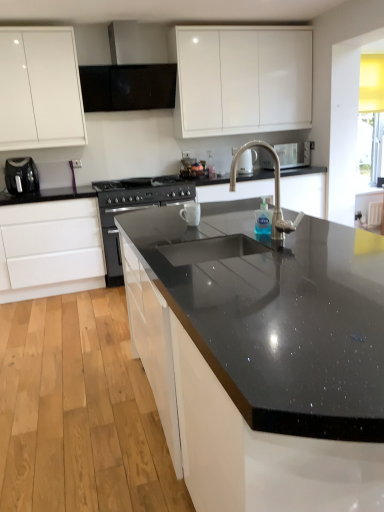
Describe the element at coordinates (275, 191) in the screenshot. This screenshot has width=384, height=512. I see `polished stainless steel faucet at center` at that location.

Image resolution: width=384 pixels, height=512 pixels. What are the coordinates of `black matte exhaust hood at upper center` in the screenshot? It's located at (131, 71).

What is the approximate height of black matte exhaust hood at upper center?

black matte exhaust hood at upper center is 29.88 inches tall.

The height and width of the screenshot is (512, 384). Describe the element at coordinates (274, 193) in the screenshot. I see `black granite sink at center` at that location.

The width and height of the screenshot is (384, 512). What are the coordinates of `satin nickel faucet at upper center, which is counted as the 2th appliance, starting from the left` in the screenshot? It's located at click(x=293, y=154).

Considering the positions of point (20, 276) and point (282, 236), is point (20, 276) closer or farther from the camera than point (282, 236)?

Point (20, 276).

From the image's perspective, is white matte drawer at lower left, marked as the 1th cabinetry in a bottom-to-top arrangement, above or below polished stainless steel faucet at center?

white matte drawer at lower left, marked as the 1th cabinetry in a bottom-to-top arrangement, is below polished stainless steel faucet at center.

Is white matte drawer at lower left, marked as the 1th cabinetry in a bottom-to-top arrangement, to the left or to the right of polished stainless steel faucet at center in the image?

white matte drawer at lower left, marked as the 1th cabinetry in a bottom-to-top arrangement, is to the left of polished stainless steel faucet at center.

Considering the sizes of white matte drawer at lower left, the 2th cabinetry when ordered from top to bottom, and polished stainless steel faucet at center in the image, is white matte drawer at lower left, the 2th cabinetry when ordered from top to bottom, bigger or smaller than polished stainless steel faucet at center?

Clearly, white matte drawer at lower left, the 2th cabinetry when ordered from top to bottom, is larger in size than polished stainless steel faucet at center.

From the image's perspective, which is below, black matte exhaust hood at upper center or polished stainless steel faucet at center?

polished stainless steel faucet at center.

Considering the relative sizes of black matte exhaust hood at upper center and polished stainless steel faucet at center in the image provided, is black matte exhaust hood at upper center thinner than polished stainless steel faucet at center?

Incorrect, the width of black matte exhaust hood at upper center is not less than that of polished stainless steel faucet at center.

Is black matte exhaust hood at upper center bigger than polished stainless steel faucet at center?

Yes.

In terms of height, does satin nickel faucet at upper center, which ranks as the 1th appliance in top-to-bottom order, look taller or shorter compared to white matte drawer at lower left, the 2th cabinetry when ordered from top to bottom?

satin nickel faucet at upper center, which ranks as the 1th appliance in top-to-bottom order, is shorter than white matte drawer at lower left, the 2th cabinetry when ordered from top to bottom.

Is satin nickel faucet at upper center, which is counted as the 2th appliance, starting from the left, bigger than white matte drawer at lower left, the 2th cabinetry when ordered from top to bottom?

No, satin nickel faucet at upper center, which is counted as the 2th appliance, starting from the left, is not bigger than white matte drawer at lower left, the 2th cabinetry when ordered from top to bottom.

Is satin nickel faucet at upper center, which is counted as the 2th appliance, starting from the left, inside or outside of white matte drawer at lower left, marked as the 1th cabinetry in a bottom-to-top arrangement?

satin nickel faucet at upper center, which is counted as the 2th appliance, starting from the left, lies outside white matte drawer at lower left, marked as the 1th cabinetry in a bottom-to-top arrangement.

Consider the image. From a real-world perspective, which is physically below, satin nickel faucet at upper center, marked as the 1th appliance in a back-to-front arrangement, or white matte drawer at lower left, marked as the 1th cabinetry in a bottom-to-top arrangement?

white matte drawer at lower left, marked as the 1th cabinetry in a bottom-to-top arrangement.

Is white glossy cabinet at upper left, which ranks as the 2th cabinetry in bottom-to-top order, a part of black granite sink at center?

Definitely not — white glossy cabinet at upper left, which ranks as the 2th cabinetry in bottom-to-top order, is not inside black granite sink at center.

Considering the points (192, 219) and (44, 33), which point is in front, point (192, 219) or point (44, 33)?

The point (192, 219) is more forward.

Is black granite sink at center touching white glossy cabinet at upper left, marked as the first cabinetry in a top-to-bottom arrangement?

No, black granite sink at center is not beside white glossy cabinet at upper left, marked as the first cabinetry in a top-to-bottom arrangement.

Is black granite sink at center turned away from white glossy cabinet at upper left, marked as the first cabinetry in a top-to-bottom arrangement?

No, white glossy cabinet at upper left, marked as the first cabinetry in a top-to-bottom arrangement, is not at the back of black granite sink at center.

Does white matte drawer at lower left, marked as the 1th cabinetry in a bottom-to-top arrangement, have a larger size compared to black matte exhaust hood at upper center?

Yes.

From the picture: Which of these two, white matte drawer at lower left, the 2th cabinetry when ordered from top to bottom, or black matte exhaust hood at upper center, stands taller?

white matte drawer at lower left, the 2th cabinetry when ordered from top to bottom.

From the image's perspective, which one is positioned lower, white matte drawer at lower left, the 2th cabinetry when ordered from top to bottom, or black matte exhaust hood at upper center?

white matte drawer at lower left, the 2th cabinetry when ordered from top to bottom, is shown below in the image.

Is white matte drawer at lower left, the 2th cabinetry when ordered from top to bottom, positioned beyond the bounds of black matte exhaust hood at upper center?

Absolutely, white matte drawer at lower left, the 2th cabinetry when ordered from top to bottom, is external to black matte exhaust hood at upper center.

Is black granite sink at center far away from satin nickel faucet at upper center, which is the first appliance in right-to-left order?

No, black granite sink at center is in close proximity to satin nickel faucet at upper center, which is the first appliance in right-to-left order.

Does black granite sink at center have a greater height compared to satin nickel faucet at upper center, which ranks as the 1th appliance in top-to-bottom order?

Indeed, black granite sink at center has a greater height compared to satin nickel faucet at upper center, which ranks as the 1th appliance in top-to-bottom order.

From the image's perspective, relative to satin nickel faucet at upper center, which is the second appliance in bottom-to-top order, is black granite sink at center above or below?

From the image's perspective, black granite sink at center appears below satin nickel faucet at upper center, which is the second appliance in bottom-to-top order.

Does black granite sink at center contain white matte drawer at lower left, marked as the 1th cabinetry in a bottom-to-top arrangement?

No, white matte drawer at lower left, marked as the 1th cabinetry in a bottom-to-top arrangement, is not a part of black granite sink at center.

Is black granite sink at center closer to camera compared to white matte drawer at lower left, marked as the 1th cabinetry in a bottom-to-top arrangement?

No, black granite sink at center is further to the viewer.

Is black granite sink at center not close to white matte drawer at lower left, marked as the 1th cabinetry in a bottom-to-top arrangement?

Absolutely, black granite sink at center is distant from white matte drawer at lower left, marked as the 1th cabinetry in a bottom-to-top arrangement.

Considering the positions of objects black granite sink at center and white matte drawer at lower left, marked as the 1th cabinetry in a bottom-to-top arrangement, in the image provided, who is more to the left, black granite sink at center or white matte drawer at lower left, marked as the 1th cabinetry in a bottom-to-top arrangement,?

From the viewer's perspective, white matte drawer at lower left, marked as the 1th cabinetry in a bottom-to-top arrangement, appears more on the left side.

This screenshot has width=384, height=512. I want to click on cabinetry below the polished stainless steel faucet at center (from a real-world perspective), so click(x=50, y=249).

You are a GUI agent. You are given a task and a screenshot of the screen. Output one action in this format:
    pyautogui.click(x=<x>, y=<y>)
    Task: Click on the tap on the right side of black matte exhaust hood at upper center
    
    Given the screenshot: What is the action you would take?
    pyautogui.click(x=275, y=191)

Looking at the image, which one is located further to black granite sink at center, black matte exhaust hood at upper center or satin nickel faucet at upper center, which ranks as the 1th appliance in top-to-bottom order?

black matte exhaust hood at upper center lies further to black granite sink at center than the other object.

When comparing their distances from black matte exhaust hood at upper center, does satin nickel faucet at upper center, marked as the 1th appliance in a back-to-front arrangement, or white matte drawer at lower left, marked as the 1th cabinetry in a bottom-to-top arrangement, seem closer?

Among the two, white matte drawer at lower left, marked as the 1th cabinetry in a bottom-to-top arrangement, is located nearer to black matte exhaust hood at upper center.

From the image, which object appears to be farther from white glossy cabinet at upper left, marked as the first cabinetry in a top-to-bottom arrangement, black granite sink at center or satin nickel faucet at upper center, marked as the 1th appliance in a back-to-front arrangement?

The object further to white glossy cabinet at upper left, marked as the first cabinetry in a top-to-bottom arrangement, is satin nickel faucet at upper center, marked as the 1th appliance in a back-to-front arrangement.

Considering their positions, is white glossy cabinet at upper left, marked as the first cabinetry in a top-to-bottom arrangement, positioned further to white matte drawer at lower left, the 2th cabinetry when ordered from top to bottom, than black plastic toaster at left, positioned as the 2th appliance in back-to-front order?

The object further to white matte drawer at lower left, the 2th cabinetry when ordered from top to bottom, is white glossy cabinet at upper left, marked as the first cabinetry in a top-to-bottom arrangement.

From the image, which object appears to be nearer to black matte exhaust hood at upper center, black granite sink at center or polished stainless steel faucet at center?

polished stainless steel faucet at center is closer to black matte exhaust hood at upper center.

Which object lies further to the anchor point black matte exhaust hood at upper center, white glossy cabinet at upper left, marked as the first cabinetry in a top-to-bottom arrangement, or polished stainless steel faucet at center?

polished stainless steel faucet at center.

From the image, which object appears to be nearer to satin nickel faucet at upper center, which ranks as the 1th appliance in top-to-bottom order, white matte drawer at lower left, the 2th cabinetry when ordered from top to bottom, or black matte exhaust hood at upper center?

black matte exhaust hood at upper center.

Looking at the image, which one is located closer to black plastic toaster at left, positioned as the 2th appliance in back-to-front order, white glossy cabinet at upper left, which ranks as the 2th cabinetry in bottom-to-top order, or satin nickel faucet at upper center, placed as the 2th appliance when sorted from front to back?

white glossy cabinet at upper left, which ranks as the 2th cabinetry in bottom-to-top order, is closer to black plastic toaster at left, positioned as the 2th appliance in back-to-front order.

In order to click on sink between black matte exhaust hood at upper center and satin nickel faucet at upper center, which is the first appliance in right-to-left order, in the horizontal direction in this screenshot , I will do `click(274, 193)`.

I want to click on appliance between polished stainless steel faucet at center and black granite sink at center in the front-back direction, so click(21, 176).

You are a GUI agent. You are given a task and a screenshot of the screen. Output one action in this format:
    pyautogui.click(x=<x>, y=<y>)
    Task: Click on the exhaust hood located between white glossy cabinet at upper left, which ranks as the 2th cabinetry in bottom-to-top order, and satin nickel faucet at upper center, which is the first appliance in right-to-left order, in the left-right direction
    The height and width of the screenshot is (512, 384).
    Given the screenshot: What is the action you would take?
    [131, 71]

This screenshot has width=384, height=512. I want to click on exhaust hood situated between white glossy cabinet at upper left, which ranks as the 2th cabinetry in bottom-to-top order, and black granite sink at center from left to right, so click(131, 71).